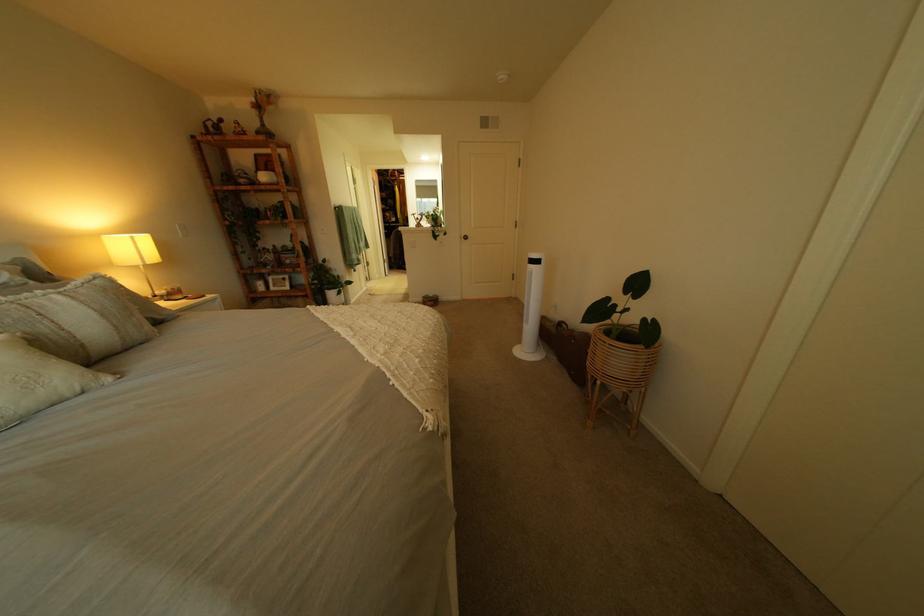
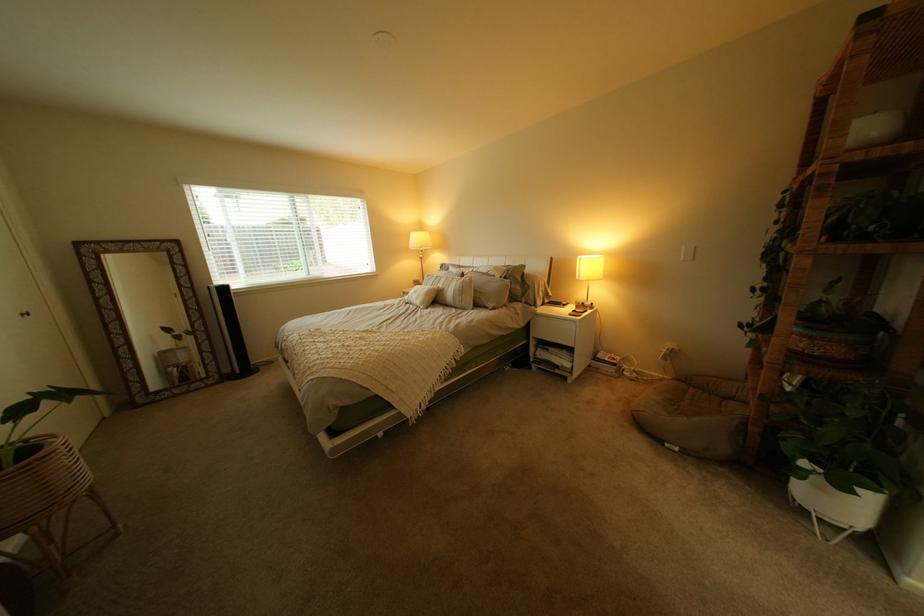
In the second image, find the point that corresponds to [322,264] in the first image.

(805, 354)